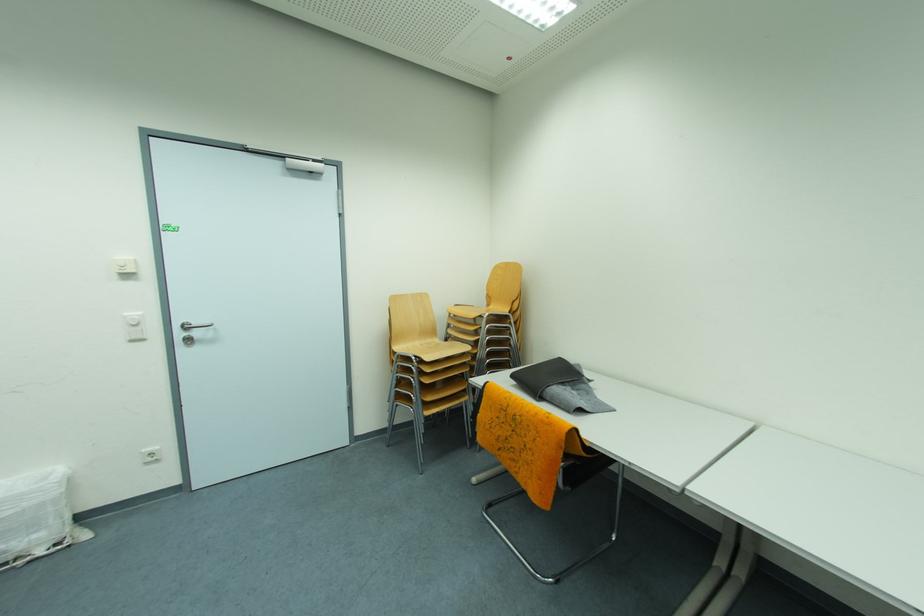
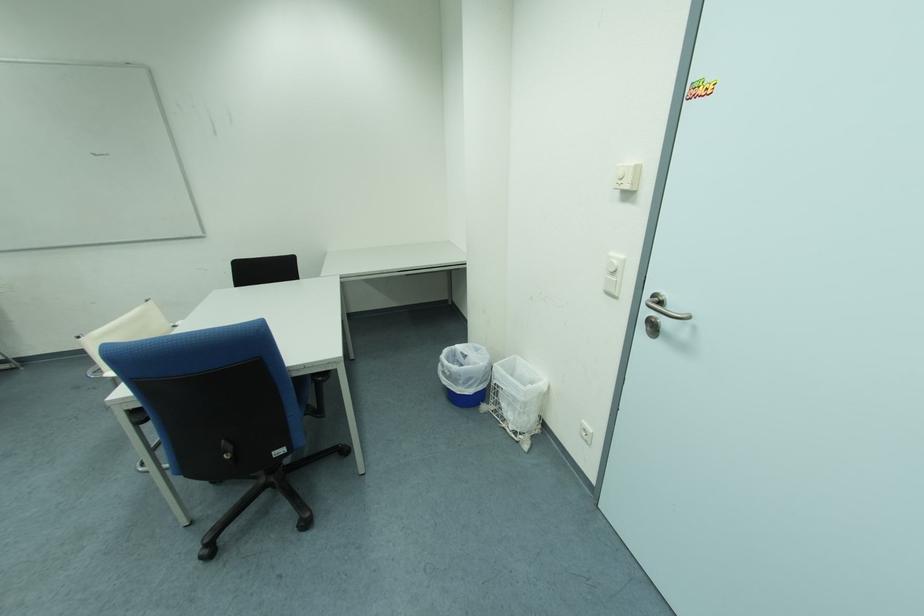
Locate, in the second image, the point that corresponds to [141,344] in the first image.

(616, 296)